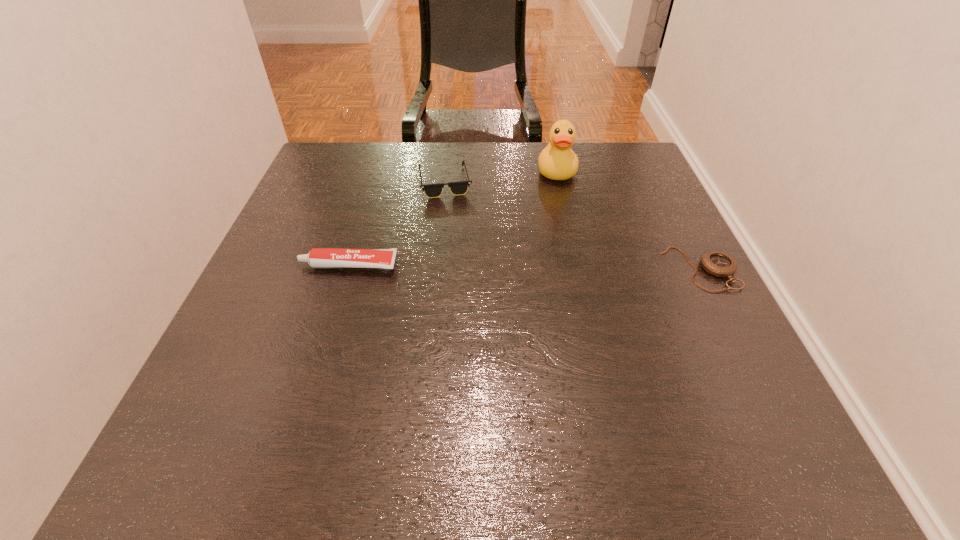
At what (x,y) coordinates should I click in order to perform the action: click on the leftmost object. Please return your answer as a coordinate pair (x, y). Looking at the image, I should click on click(318, 258).

At what (x,y) coordinates should I click in order to perform the action: click on pocket watch. Please return your answer as a coordinate pair (x, y). Looking at the image, I should click on (717, 263).

Locate an element on the screen. The image size is (960, 540). the shortest object is located at coordinates (717, 263).

You are a GUI agent. You are given a task and a screenshot of the screen. Output one action in this format:
    pyautogui.click(x=<x>, y=<y>)
    Task: Click on the sunglasses
    Image resolution: width=960 pixels, height=540 pixels.
    Given the screenshot: What is the action you would take?
    pyautogui.click(x=457, y=188)

Where is `the second object from right to left`? The image size is (960, 540). the second object from right to left is located at coordinates (557, 161).

Locate an element on the screen. This screenshot has height=540, width=960. duck is located at coordinates point(557,161).

The image size is (960, 540). Identify the location of vacant region located 0.050m at the nozzle of the toothpaste. (276, 266).

Find the location of a particular element. This screenshot has height=540, width=960. vacant space located 0.280m on the left of the pocket watch is located at coordinates (533, 269).

This screenshot has height=540, width=960. Identify the location of vacant area situated 0.200m on the lenses of the second object from left to right. (512, 237).

The width and height of the screenshot is (960, 540). In order to click on vacant space located 0.270m on the lenses of the second object from left to right in this screenshot , I will do `click(532, 253)`.